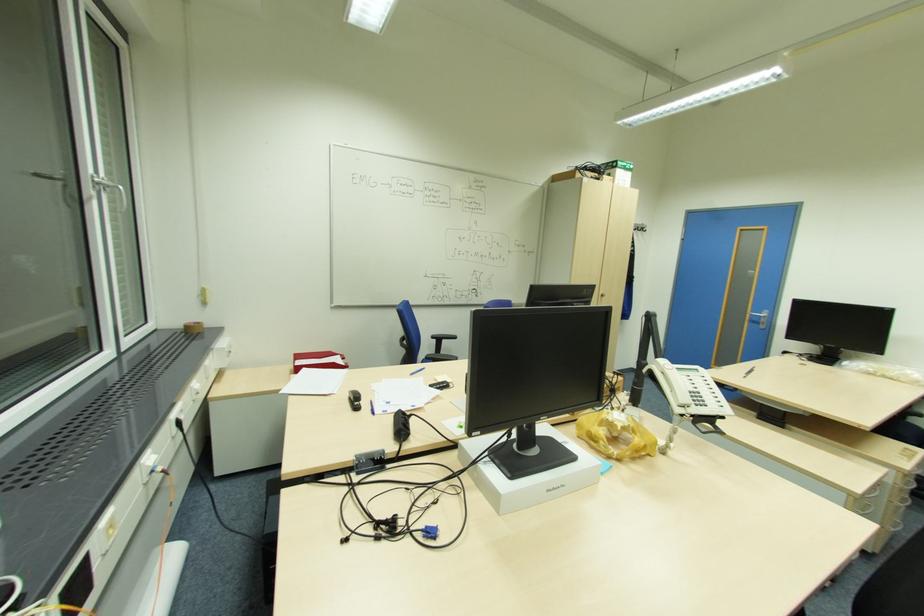
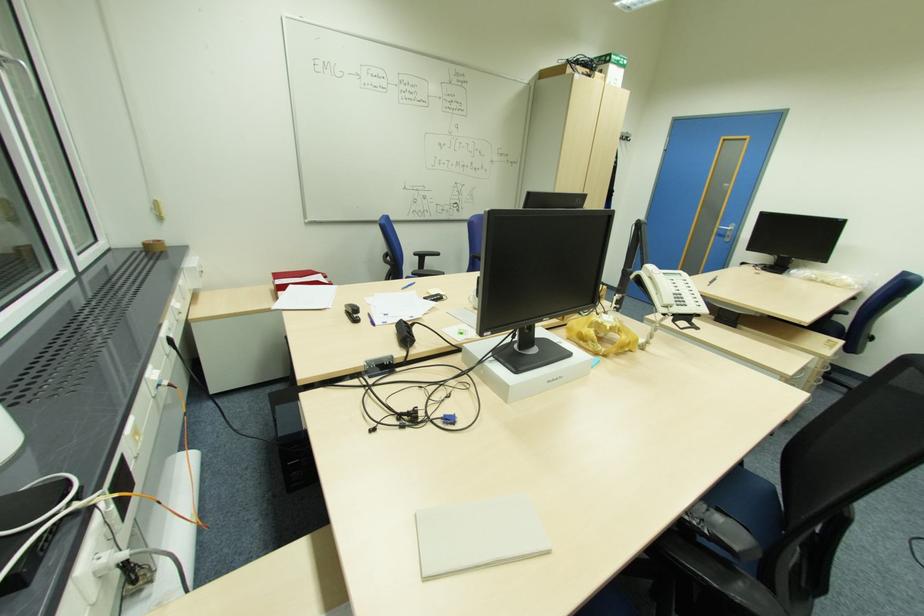
The point at [359,408] is marked in the first image. Where is the corresponding point in the second image?

(359, 321)